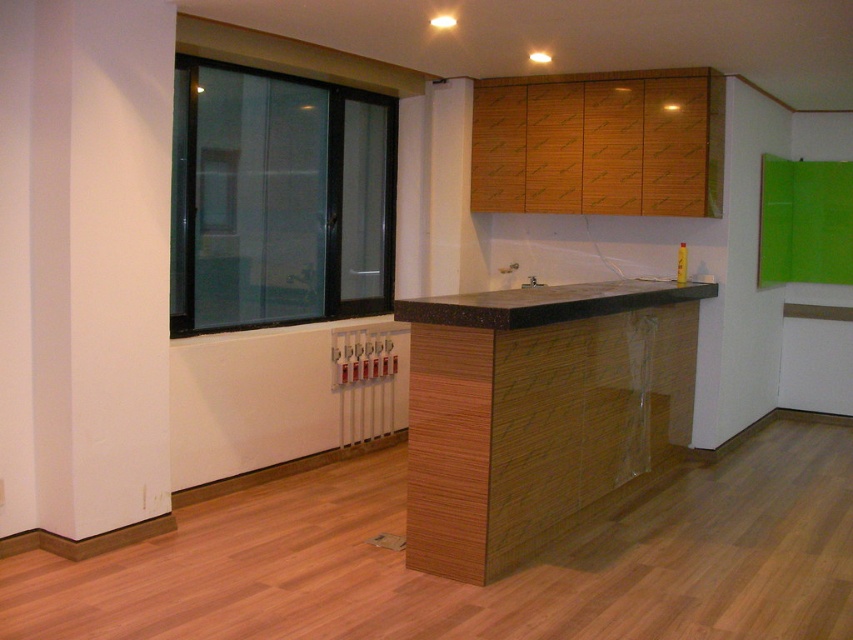
You are a chef preparing to install a new kitchen appliance that requires a stable surface. You have two options in sight, the black glass window at left and the black marble countertop at center. Which object is suitable for placing the appliance?

The black marble countertop at center is suitable for placing the appliance because it is a stable surface, while the black glass window at left is above it and likely not a solid surface.